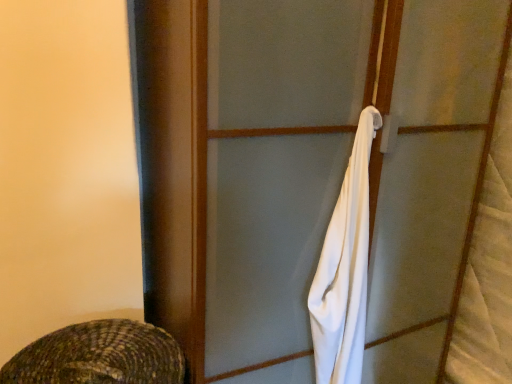
Question: From a real-world perspective, is white cloth at right above or below white fabric at center?

Choices:
 (A) below
 (B) above

Answer: (B)

Question: Considering the positions of white cloth at right and white fabric at center in the image, is white cloth at right wider or thinner than white fabric at center?

Choices:
 (A) wide
 (B) thin

Answer: (B)

Question: From the image's perspective, is white cloth at right positioned above or below white fabric at center?

Choices:
 (A) above
 (B) below

Answer: (A)

Question: Considering the positions of white fabric at center and white cloth at right in the image, is white fabric at center bigger or smaller than white cloth at right?

Choices:
 (A) big
 (B) small

Answer: (A)

Question: Is point (209, 18) positioned closer to the camera than point (326, 324)?

Choices:
 (A) closer
 (B) farther

Answer: (A)

Question: From the image's perspective, is white fabric at center located above or below white cloth at right?

Choices:
 (A) above
 (B) below

Answer: (B)

Question: In terms of height, does white fabric at center look taller or shorter compared to white cloth at right?

Choices:
 (A) short
 (B) tall

Answer: (B)